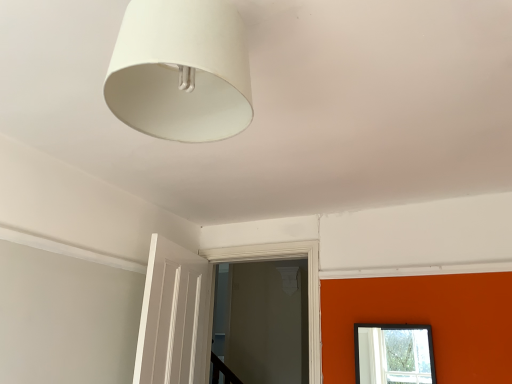
Question: Relative to white matte lampshade at upper center, is white painted wood door frame at center in front or behind?

Choices:
 (A) behind
 (B) front

Answer: (A)

Question: Is white painted wood door frame at center spatially inside white matte lampshade at upper center, or outside of it?

Choices:
 (A) inside
 (B) outside

Answer: (B)

Question: From the image's perspective, is white painted wood door frame at center located above or below white matte lampshade at upper center?

Choices:
 (A) below
 (B) above

Answer: (A)

Question: Is white matte lampshade at upper center inside or outside of white painted wood door frame at center?

Choices:
 (A) inside
 (B) outside

Answer: (B)

Question: Considering the positions of white matte lampshade at upper center and white painted wood door frame at center in the image, is white matte lampshade at upper center wider or thinner than white painted wood door frame at center?

Choices:
 (A) wide
 (B) thin

Answer: (A)

Question: In terms of height, does white matte lampshade at upper center look taller or shorter compared to white painted wood door frame at center?

Choices:
 (A) short
 (B) tall

Answer: (A)

Question: From a real-world perspective, is white matte lampshade at upper center physically located above or below white painted wood door frame at center?

Choices:
 (A) above
 (B) below

Answer: (A)